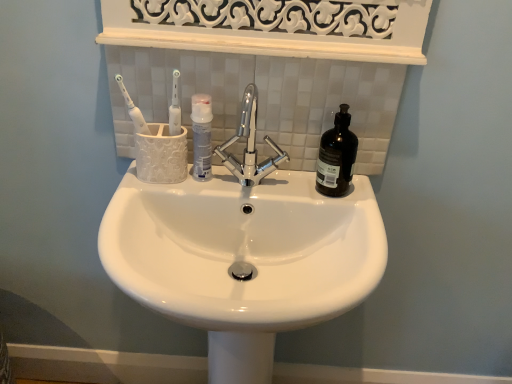
This screenshot has height=384, width=512. What are the coordinates of `vacant area located to the right-hand side of white matte mouthwash at center, which is the first mouthwash in left-to-right order` in the screenshot? It's located at pyautogui.click(x=261, y=179).